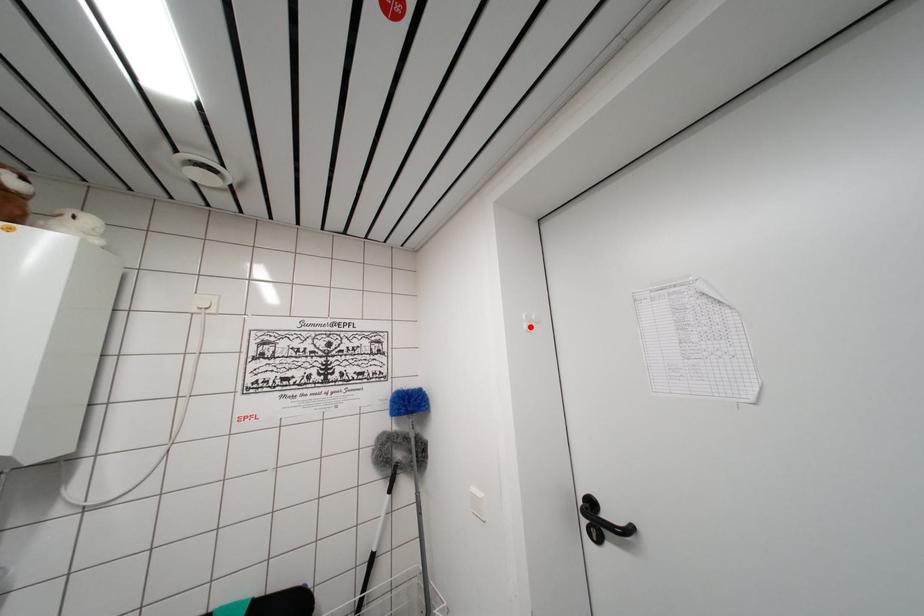
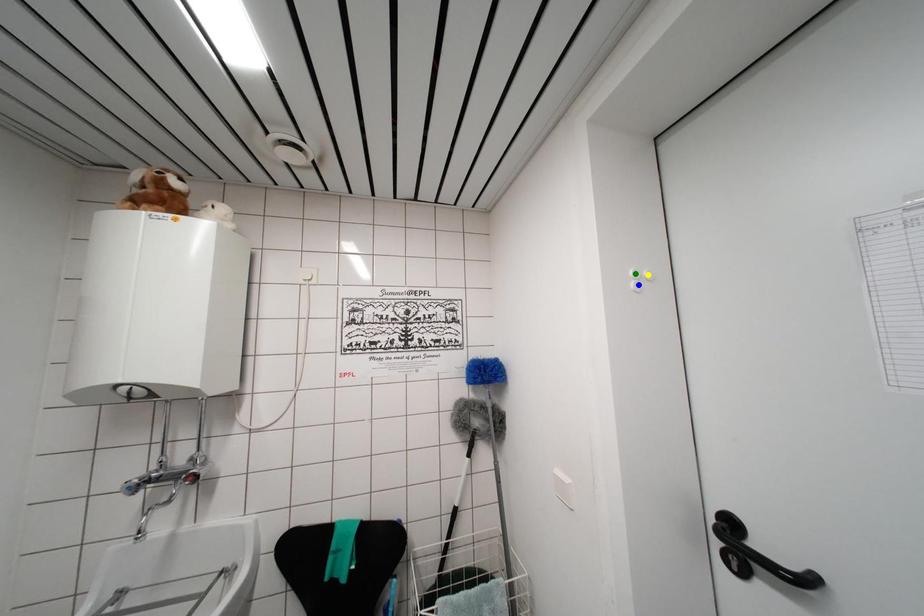
Question: I am providing you with two images of the same scene from different viewpoints. A red point is marked on the first image. You are given multiple points on the second image. Which point in image 2 is actually the same real-world point as the red point in image 1?

Choices:
 (A) green point
 (B) blue point
 (C) yellow point

Answer: (B)